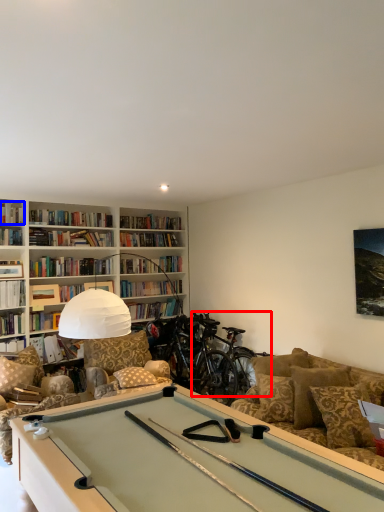
Question: Which object appears farthest to the camera in this image, mountain bike (highlighted by a red box) or book (highlighted by a blue box)?

Choices:
 (A) mountain bike
 (B) book

Answer: (B)